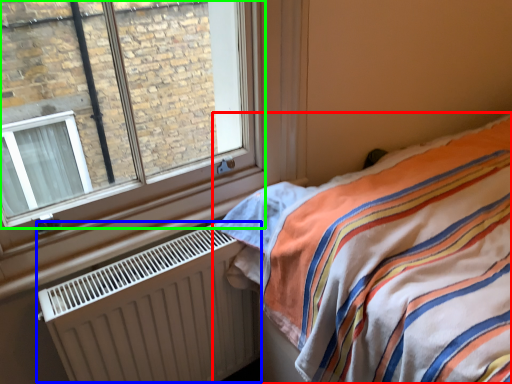
Question: Which is nearer to the bed (highlighted by a red box)? radiator (highlighted by a blue box) or window (highlighted by a green box).

Choices:
 (A) radiator
 (B) window

Answer: (A)